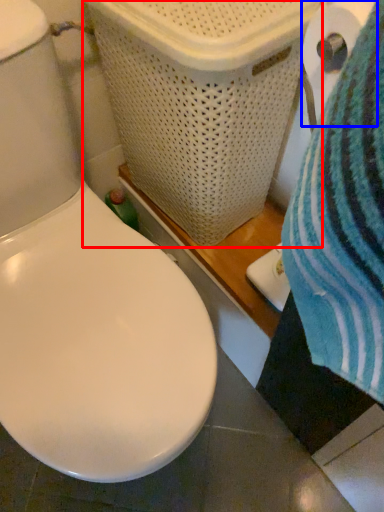
Question: Which object appears closest to the camera in this image, laundry basket (highlighted by a red box) or toilet paper (highlighted by a blue box)?

Choices:
 (A) laundry basket
 (B) toilet paper

Answer: (B)